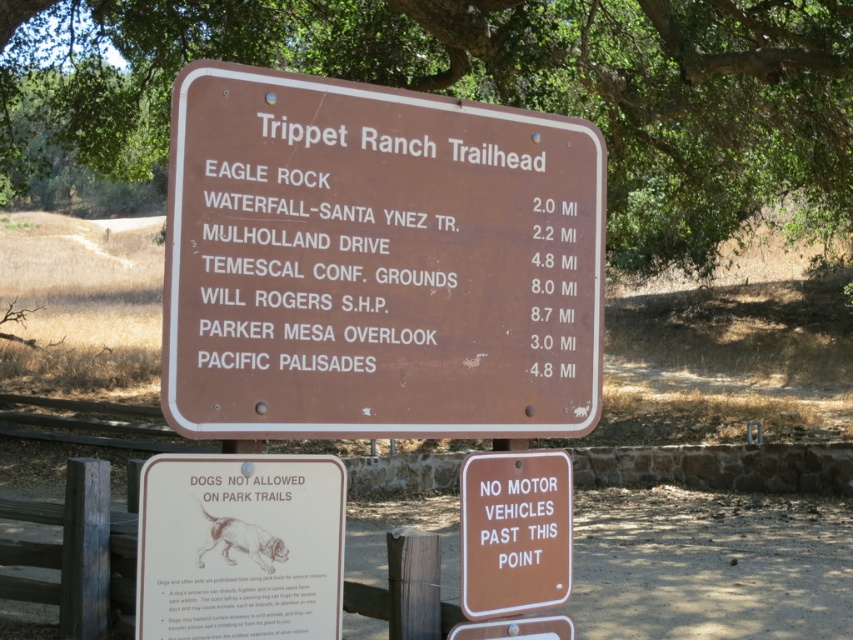
Question: Which point is closer to the camera taking this photo?

Choices:
 (A) (650, 177)
 (B) (506, 580)
 (C) (192, 481)
 (D) (212, 224)

Answer: (C)

Question: Does matte brown sign at center come in front of brown matte sign at lower right?

Choices:
 (A) yes
 (B) no

Answer: (A)

Question: Does brown wooden sign at center appear on the right side of brown matte sign at lower right?

Choices:
 (A) no
 (B) yes

Answer: (A)

Question: Which of the following is the closest to the observer?

Choices:
 (A) green leafy tree at upper center
 (B) brown matte sign at lower right
 (C) matte brown sign at center

Answer: (C)

Question: Does green leafy tree at upper center come in front of matte brown sign at center?

Choices:
 (A) no
 (B) yes

Answer: (A)

Question: Which point is farther from the camera taking this photo?

Choices:
 (A) (228, 56)
 (B) (323, 84)
 (C) (459, 499)
 (D) (199, 612)

Answer: (A)